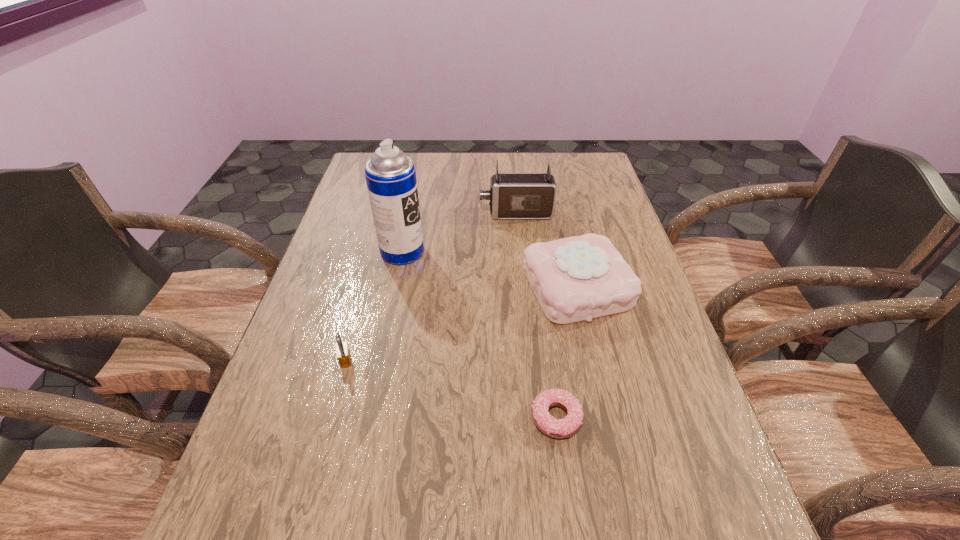
Locate an element on the screen. The image size is (960, 540). vacant space located at the lens of the camcorder is located at coordinates (357, 213).

This screenshot has height=540, width=960. In order to click on vacant space located 0.140m at the lens of the camcorder in this screenshot , I will do `click(435, 213)`.

Image resolution: width=960 pixels, height=540 pixels. I want to click on blank area located at the lens of the camcorder, so click(421, 213).

Identify the location of vacant space located 0.240m on the back of the third tallest object. This screenshot has width=960, height=540. (558, 204).

Identify the location of vacant space located on the front of the leftmost object. (317, 465).

I want to click on free space located on the left of the nearest object, so [x=393, y=418].

You are a GUI agent. You are given a task and a screenshot of the screen. Output one action in this format:
    pyautogui.click(x=<x>, y=<y>)
    Task: Click on the aerosol can present at the left edge
    Image resolution: width=960 pixels, height=540 pixels.
    Given the screenshot: What is the action you would take?
    pyautogui.click(x=390, y=175)

Locate an element on the screen. The image size is (960, 540). padlock located in the left edge section of the desktop is located at coordinates pos(343,354).

At what (x,y) coordinates should I click in order to perform the action: click on object located at the right edge. Please return your answer as a coordinate pair (x, y). This screenshot has width=960, height=540. Looking at the image, I should click on (578, 278).

This screenshot has width=960, height=540. In order to click on vacant area at the left edge in this screenshot , I will do `click(374, 233)`.